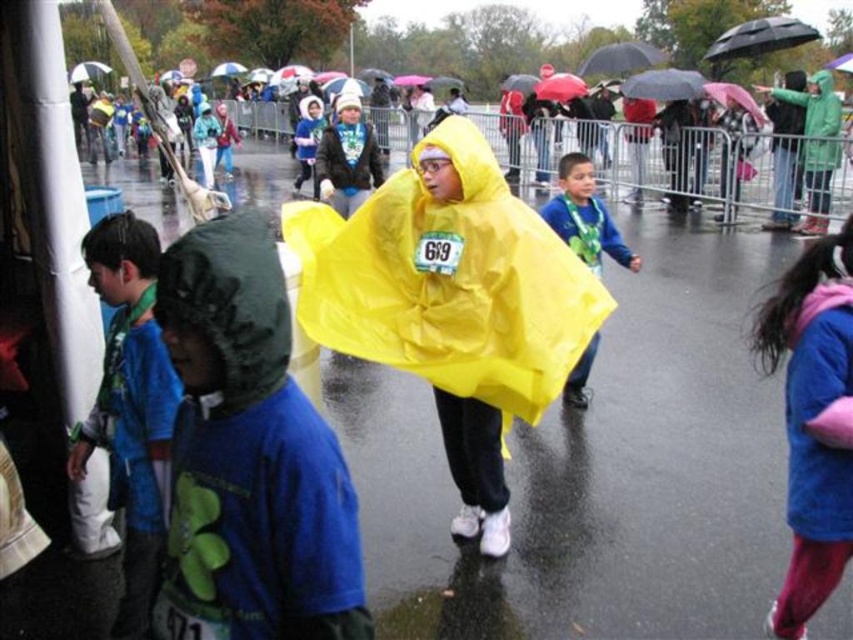
Question: Is blue cotton shirt at left to the right of matte yellow raincoat at center from the viewer's perspective?

Choices:
 (A) no
 (B) yes

Answer: (A)

Question: Is blue cotton shirt at left further to camera compared to matte yellow raincoat at center?

Choices:
 (A) no
 (B) yes

Answer: (A)

Question: Which point appears closest to the camera in this image?

Choices:
 (A) (572, 188)
 (B) (115, 285)

Answer: (B)

Question: Does blue cotton shirt at left appear on the right side of matte yellow raincoat at center?

Choices:
 (A) yes
 (B) no

Answer: (B)

Question: Which of the following is the closest to the observer?

Choices:
 (A) matte yellow raincoat at center
 (B) blue cotton shirt at left

Answer: (B)